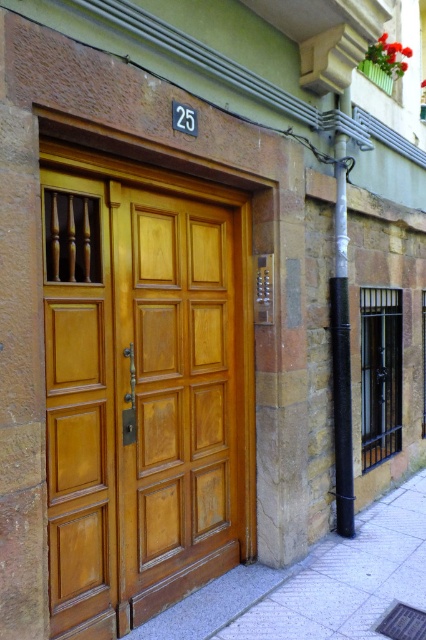
Question: Among these objects, which one is farthest from the camera?

Choices:
 (A) gray concrete pavement at lower right
 (B) white painted metal pole at right

Answer: (B)

Question: Can you confirm if wooden door at center is wider than white painted metal pole at right?

Choices:
 (A) no
 (B) yes

Answer: (B)

Question: Is wooden door at center positioned behind gray concrete pavement at lower right?

Choices:
 (A) yes
 (B) no

Answer: (B)

Question: Does wooden door at center appear over white painted metal pole at right?

Choices:
 (A) no
 (B) yes

Answer: (A)

Question: Estimate the real-world distances between objects in this image. Which object is closer to the gray concrete pavement at lower right?

Choices:
 (A) wooden door at center
 (B) white painted metal pole at right

Answer: (B)

Question: Which point is farther to the camera?

Choices:
 (A) (345, 396)
 (B) (198, 545)
 (C) (359, 614)

Answer: (A)